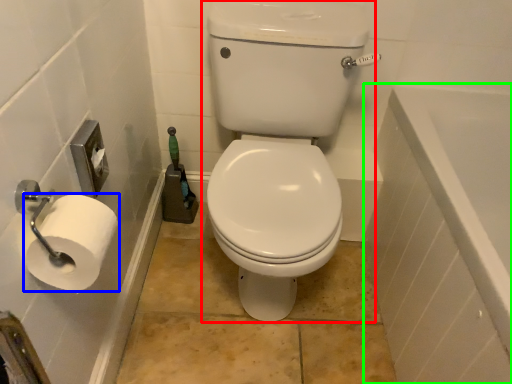
Question: Considering the real-world distances, which object is closest to sit (highlighted by a red box)? toilet paper (highlighted by a blue box) or bath (highlighted by a green box).

Choices:
 (A) toilet paper
 (B) bath

Answer: (B)